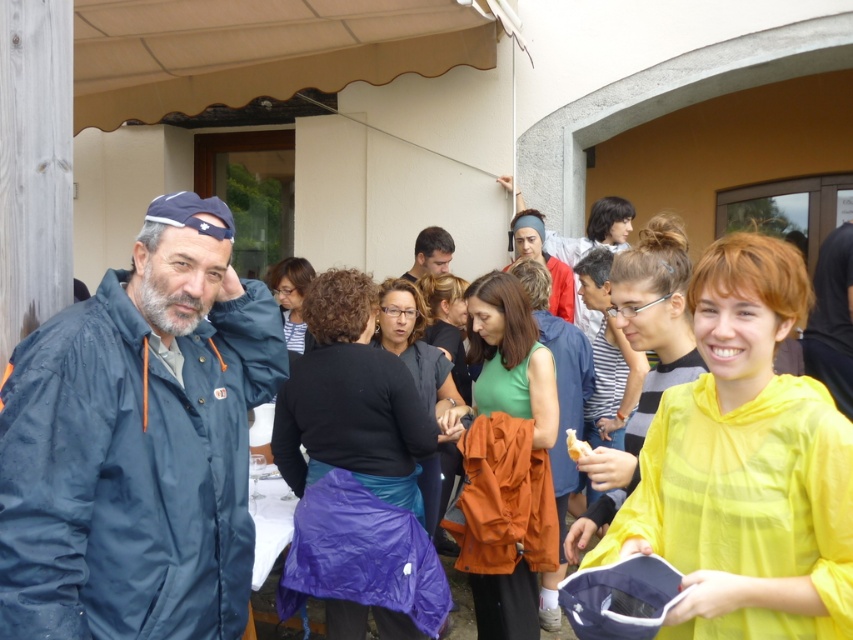
Based on the photo, you are standing in the outdoor gathering area and want to move towards the two points marked in the image. Which point, point (233, 576) or point (427, 246), will you reach first?

Point (233, 576) is closer to the viewer than point (427, 246), so you will reach point (233, 576) first.